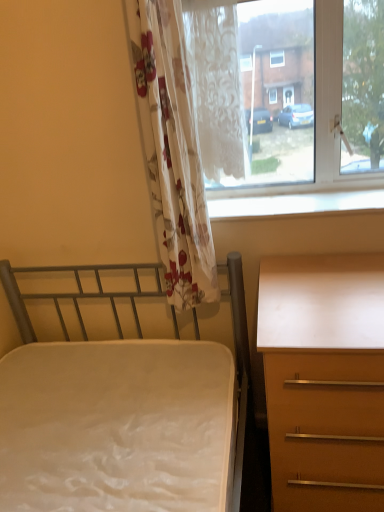
In order to click on empty space that is ontop of matte brown desk at right (from a real-world perspective) in this screenshot , I will do click(x=326, y=291).